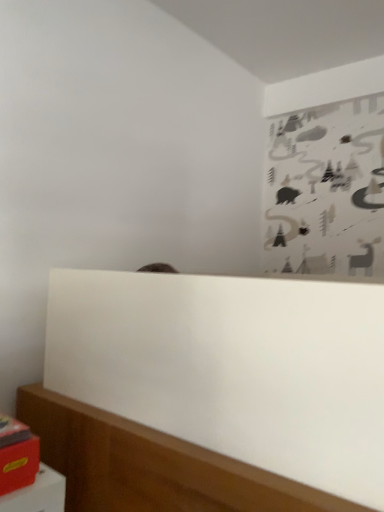
This screenshot has height=512, width=384. What do you see at coordinates (17, 455) in the screenshot? I see `matte red paperback book at lower left` at bounding box center [17, 455].

Measure the distance between point (7, 482) and camera.

Point (7, 482) is 20.24 inches from camera.

Find the location of `matte red paperback book at lower left`. matte red paperback book at lower left is located at coordinates (17, 455).

The image size is (384, 512). In order to click on matte red paperback book at lower left in this screenshot , I will do [17, 455].